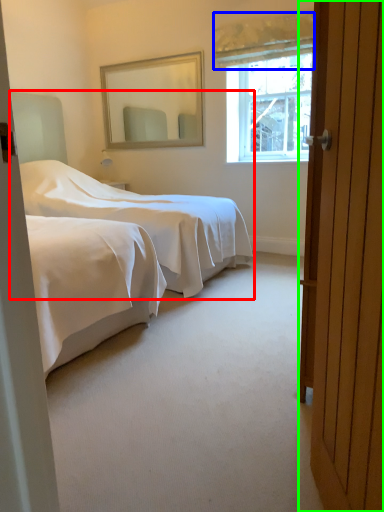
Question: Which object is positioned closest to bed (highlighted by a red box)? Select from curtain (highlighted by a blue box) and door (highlighted by a green box).

Choices:
 (A) curtain
 (B) door

Answer: (A)